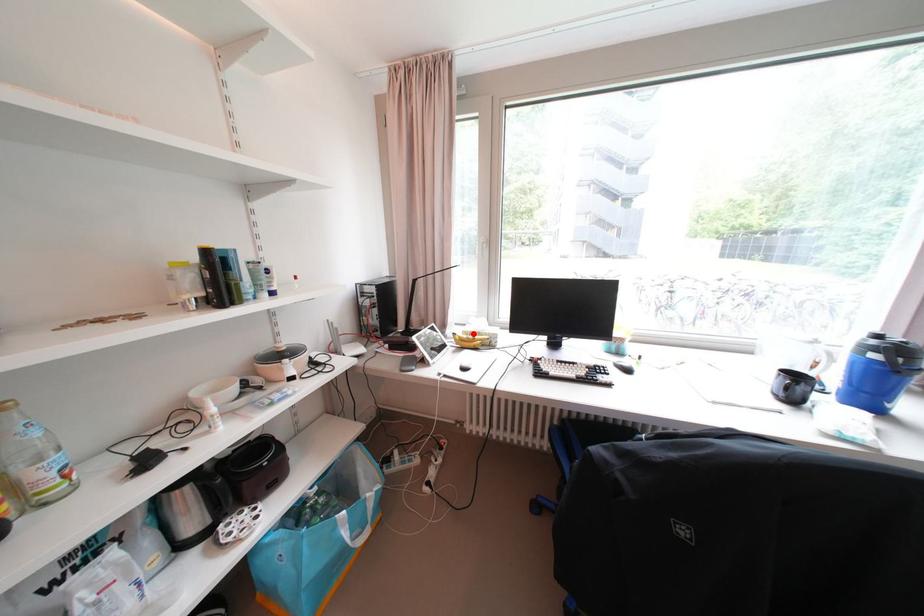
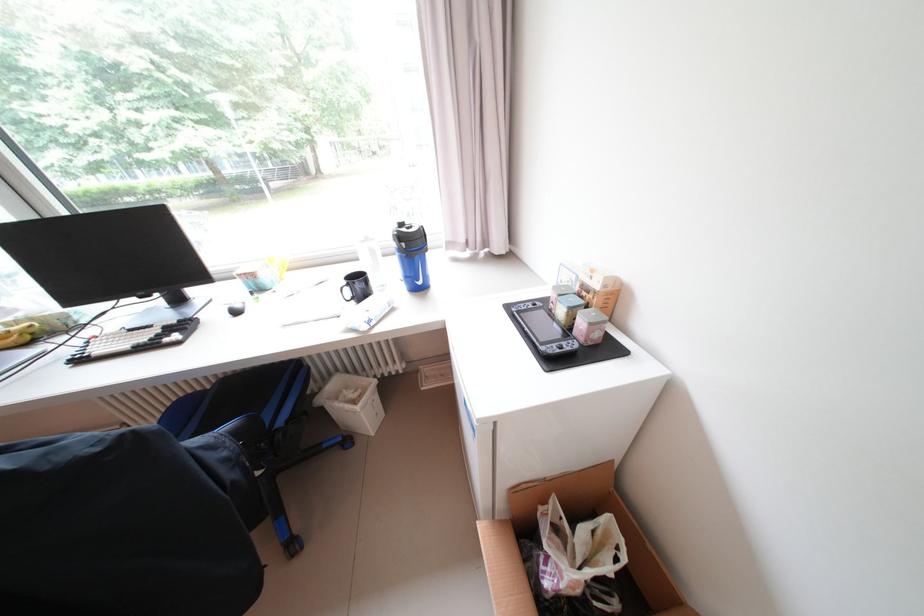
The point at the highlighted location is marked in the first image. Where is the corresponding point in the second image?

(15, 326)